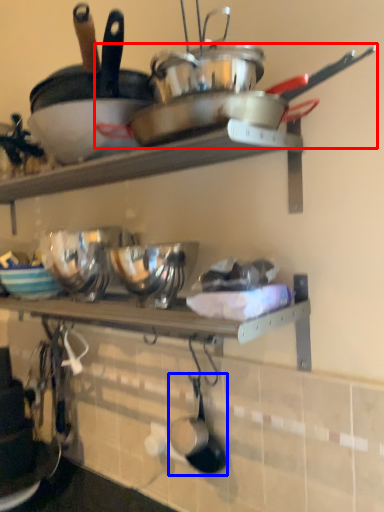
Question: Which object is further to the camera taking this photo, wok (highlighted by a red box) or frying pan (highlighted by a blue box)?

Choices:
 (A) wok
 (B) frying pan

Answer: (B)